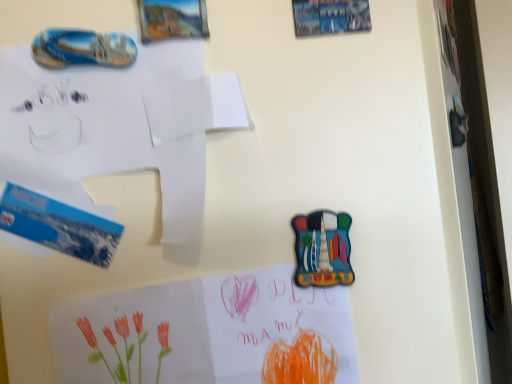
How much space does white paper at upper left, placed as the 1th paper when sorted from top to bottom, occupy vertically?

8.21 inches.

At what (x,y) coordinates should I click in order to perform the action: click on white paper at upper left, placed as the 1th paper when sorted from top to bottom. Please return your answer as a coordinate pair (x, y). Looking at the image, I should click on (118, 124).

Measure the distance between point [141,119] and camera.

The depth of point [141,119] is 16.54 inches.

The image size is (512, 384). Describe the element at coordinates (118, 124) in the screenshot. I see `white paper at upper left, placed as the 1th paper when sorted from top to bottom` at that location.

What is the approximate height of watercolor paper at lower center, the 1th paper when ordered from bottom to top?

watercolor paper at lower center, the 1th paper when ordered from bottom to top, is 8.59 inches in height.

This screenshot has width=512, height=384. What do you see at coordinates (207, 332) in the screenshot? I see `watercolor paper at lower center, which ranks as the second paper in top-to-bottom order` at bounding box center [207, 332].

The image size is (512, 384). Find the location of `watercolor paper at lower center, which ranks as the second paper in top-to-bottom order`. watercolor paper at lower center, which ranks as the second paper in top-to-bottom order is located at coordinates (207, 332).

Where is `white paper at upper left, which appears as the 2th paper when ordered from the bottom`? The image size is (512, 384). white paper at upper left, which appears as the 2th paper when ordered from the bottom is located at coordinates (118, 124).

Considering the relative positions of watercolor paper at lower center, which ranks as the second paper in top-to-bottom order, and white paper at upper left, which appears as the 2th paper when ordered from the bottom, in the image provided, is watercolor paper at lower center, which ranks as the second paper in top-to-bottom order, to the left of white paper at upper left, which appears as the 2th paper when ordered from the bottom, from the viewer's perspective?

No.

Is watercolor paper at lower center, which ranks as the second paper in top-to-bottom order, in front of or behind white paper at upper left, which appears as the 2th paper when ordered from the bottom, in the image?

Visually, watercolor paper at lower center, which ranks as the second paper in top-to-bottom order, is located behind white paper at upper left, which appears as the 2th paper when ordered from the bottom.

Is point (166, 335) closer or farther from the camera than point (72, 69)?

Point (166, 335) appears to be closer to the viewer than point (72, 69).

From the image's perspective, which is above, watercolor paper at lower center, the 1th paper when ordered from bottom to top, or white paper at upper left, placed as the 1th paper when sorted from top to bottom?

white paper at upper left, placed as the 1th paper when sorted from top to bottom, from the image's perspective.

From a real-world perspective, is watercolor paper at lower center, which ranks as the second paper in top-to-bottom order, located higher than white paper at upper left, which appears as the 2th paper when ordered from the bottom?

No.

Which object is wider, watercolor paper at lower center, the 1th paper when ordered from bottom to top, or white paper at upper left, which appears as the 2th paper when ordered from the bottom?

Wider between the two is white paper at upper left, which appears as the 2th paper when ordered from the bottom.

Does watercolor paper at lower center, which ranks as the second paper in top-to-bottom order, have a lesser height compared to white paper at upper left, placed as the 1th paper when sorted from top to bottom?

In fact, watercolor paper at lower center, which ranks as the second paper in top-to-bottom order, may be taller than white paper at upper left, placed as the 1th paper when sorted from top to bottom.

Which of these two, watercolor paper at lower center, which ranks as the second paper in top-to-bottom order, or white paper at upper left, which appears as the 2th paper when ordered from the bottom, is bigger?

With larger size is white paper at upper left, which appears as the 2th paper when ordered from the bottom.

Would you say white paper at upper left, placed as the 1th paper when sorted from top to bottom, is part of watercolor paper at lower center, the 1th paper when ordered from bottom to top,'s contents?

No, white paper at upper left, placed as the 1th paper when sorted from top to bottom, is not a part of watercolor paper at lower center, the 1th paper when ordered from bottom to top.

Is watercolor paper at lower center, which ranks as the second paper in top-to-bottom order, with white paper at upper left, placed as the 1th paper when sorted from top to bottom?

There is a gap between watercolor paper at lower center, which ranks as the second paper in top-to-bottom order, and white paper at upper left, placed as the 1th paper when sorted from top to bottom.

Does watercolor paper at lower center, which ranks as the second paper in top-to-bottom order, turn towards white paper at upper left, which appears as the 2th paper when ordered from the bottom?

No, watercolor paper at lower center, which ranks as the second paper in top-to-bottom order, does not turn towards white paper at upper left, which appears as the 2th paper when ordered from the bottom.

What's the angular difference between watercolor paper at lower center, the 1th paper when ordered from bottom to top, and white paper at upper left, which appears as the 2th paper when ordered from the bottom,'s facing directions?

The facing directions of watercolor paper at lower center, the 1th paper when ordered from bottom to top, and white paper at upper left, which appears as the 2th paper when ordered from the bottom, are 89.7 degrees apart.

This screenshot has width=512, height=384. Find the location of `paper below the white paper at upper left, placed as the 1th paper when sorted from top to bottom (from a real-world perspective)`. paper below the white paper at upper left, placed as the 1th paper when sorted from top to bottom (from a real-world perspective) is located at coordinates (207, 332).

Which is more to the right, white paper at upper left, which appears as the 2th paper when ordered from the bottom, or watercolor paper at lower center, the 1th paper when ordered from bottom to top?

watercolor paper at lower center, the 1th paper when ordered from bottom to top.

Does white paper at upper left, placed as the 1th paper when sorted from top to bottom, come in front of watercolor paper at lower center, which ranks as the second paper in top-to-bottom order?

Yes, white paper at upper left, placed as the 1th paper when sorted from top to bottom, is closer to the viewer.

Is point (164, 142) closer to viewer compared to point (140, 341)?

That is False.

From the image's perspective, is white paper at upper left, placed as the 1th paper when sorted from top to bottom, located above or below watercolor paper at lower center, the 1th paper when ordered from bottom to top?

white paper at upper left, placed as the 1th paper when sorted from top to bottom, is situated higher than watercolor paper at lower center, the 1th paper when ordered from bottom to top, in the image.

From a real-world perspective, which object stands above the other?

In real-world perspective, white paper at upper left, placed as the 1th paper when sorted from top to bottom, is above.

Considering the relative sizes of white paper at upper left, which appears as the 2th paper when ordered from the bottom, and watercolor paper at lower center, the 1th paper when ordered from bottom to top, in the image provided, is white paper at upper left, which appears as the 2th paper when ordered from the bottom, wider than watercolor paper at lower center, the 1th paper when ordered from bottom to top,?

Indeed, white paper at upper left, which appears as the 2th paper when ordered from the bottom, has a greater width compared to watercolor paper at lower center, the 1th paper when ordered from bottom to top.

Considering the relative sizes of white paper at upper left, placed as the 1th paper when sorted from top to bottom, and watercolor paper at lower center, which ranks as the second paper in top-to-bottom order, in the image provided, is white paper at upper left, placed as the 1th paper when sorted from top to bottom, taller than watercolor paper at lower center, which ranks as the second paper in top-to-bottom order,?

Incorrect, the height of white paper at upper left, placed as the 1th paper when sorted from top to bottom, is not larger of that of watercolor paper at lower center, which ranks as the second paper in top-to-bottom order.

Is white paper at upper left, which appears as the 2th paper when ordered from the bottom, smaller than watercolor paper at lower center, the 1th paper when ordered from bottom to top?

Incorrect, white paper at upper left, which appears as the 2th paper when ordered from the bottom, is not smaller in size than watercolor paper at lower center, the 1th paper when ordered from bottom to top.

Is white paper at upper left, placed as the 1th paper when sorted from top to bottom, located outside watercolor paper at lower center, the 1th paper when ordered from bottom to top?

white paper at upper left, placed as the 1th paper when sorted from top to bottom, lies outside watercolor paper at lower center, the 1th paper when ordered from bottom to top,'s area.

In the scene shown: Is white paper at upper left, placed as the 1th paper when sorted from top to bottom, in contact with watercolor paper at lower center, which ranks as the second paper in top-to-bottom order?

white paper at upper left, placed as the 1th paper when sorted from top to bottom, and watercolor paper at lower center, which ranks as the second paper in top-to-bottom order, are not in contact.

Is watercolor paper at lower center, which ranks as the second paper in top-to-bottom order, at the back of white paper at upper left, which appears as the 2th paper when ordered from the bottom?

No, white paper at upper left, which appears as the 2th paper when ordered from the bottom,'s orientation is not away from watercolor paper at lower center, which ranks as the second paper in top-to-bottom order.

What's the angular difference between white paper at upper left, placed as the 1th paper when sorted from top to bottom, and watercolor paper at lower center, which ranks as the second paper in top-to-bottom order,'s facing directions?

89.7 degrees.

Where is `paper that is below the white paper at upper left, which appears as the 2th paper when ordered from the bottom (from the image's perspective)`? The width and height of the screenshot is (512, 384). paper that is below the white paper at upper left, which appears as the 2th paper when ordered from the bottom (from the image's perspective) is located at coordinates (207, 332).

You are a GUI agent. You are given a task and a screenshot of the screen. Output one action in this format:
    pyautogui.click(x=<x>, y=<y>)
    Task: Click on the paper above the watercolor paper at lower center, which ranks as the second paper in top-to-bottom order (from the image's perspective)
    This screenshot has height=384, width=512.
    Given the screenshot: What is the action you would take?
    pyautogui.click(x=118, y=124)

This screenshot has width=512, height=384. I want to click on paper behind the white paper at upper left, which appears as the 2th paper when ordered from the bottom, so click(x=207, y=332).